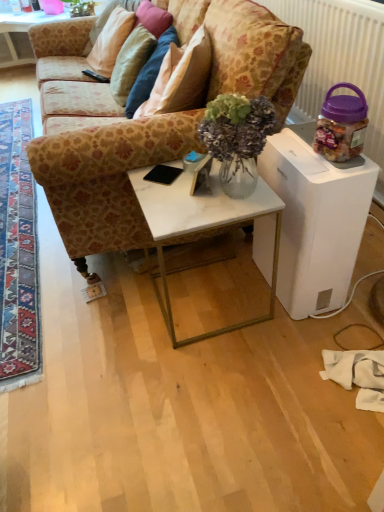
Find the location of a particular element. This screenshot has height=512, width=384. free spot in front of white marble table at center, which ranks as the 2th table in right-to-left order is located at coordinates (216, 379).